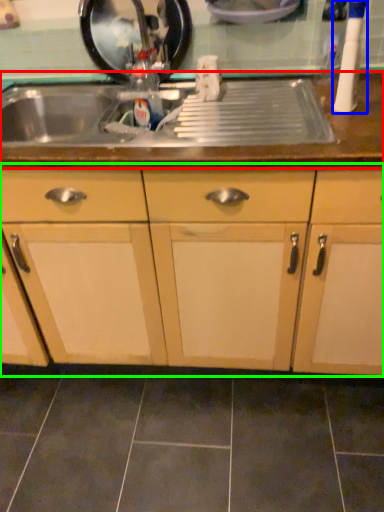
Question: Which object is the closest to the countertop (highlighted by a red box)? Choose among these: appliance (highlighted by a blue box) or cabinetry (highlighted by a green box).

Choices:
 (A) appliance
 (B) cabinetry

Answer: (A)